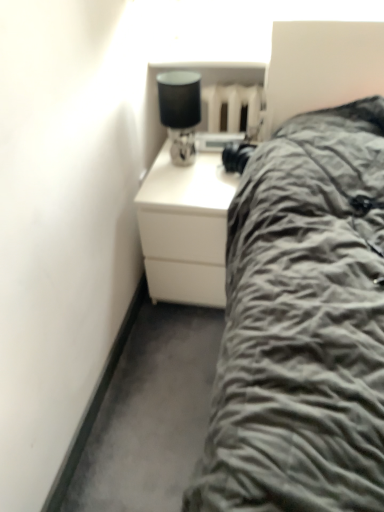
Where is `white matte chest of drawers at center`? Image resolution: width=384 pixels, height=512 pixels. white matte chest of drawers at center is located at coordinates tap(185, 228).

The image size is (384, 512). What do you see at coordinates (185, 228) in the screenshot? I see `white matte chest of drawers at center` at bounding box center [185, 228].

Measure the distance between point (203, 259) and camera.

They are 5.21 feet apart.

This screenshot has height=512, width=384. What are the coordinates of `matte black lampshade at upper right` in the screenshot? It's located at (180, 112).

Describe the element at coordinates (180, 112) in the screenshot. I see `matte black lampshade at upper right` at that location.

This screenshot has width=384, height=512. I want to click on white matte chest of drawers at center, so click(x=185, y=228).

Which object is positioned more to the right, matte black lampshade at upper right or white matte chest of drawers at center?

From the viewer's perspective, white matte chest of drawers at center appears more on the right side.

Considering their positions, is matte black lampshade at upper right located in front of or behind white matte chest of drawers at center?

In the image, matte black lampshade at upper right appears in front of white matte chest of drawers at center.

Which is in front, point (188, 75) or point (179, 192)?

The point (188, 75) is closer to the camera.

From the image's perspective, is matte black lampshade at upper right on white matte chest of drawers at center?

Yes, from the image's perspective, matte black lampshade at upper right is over white matte chest of drawers at center.

From the picture: From a real-world perspective, is matte black lampshade at upper right physically below white matte chest of drawers at center?

Actually, matte black lampshade at upper right is physically above white matte chest of drawers at center in the real world.

Between matte black lampshade at upper right and white matte chest of drawers at center, which one has larger width?

white matte chest of drawers at center.

Who is shorter, matte black lampshade at upper right or white matte chest of drawers at center?

With less height is matte black lampshade at upper right.

Who is bigger, matte black lampshade at upper right or white matte chest of drawers at center?

white matte chest of drawers at center is bigger.

Can we say matte black lampshade at upper right lies outside white matte chest of drawers at center?

Yes, matte black lampshade at upper right is not within white matte chest of drawers at center.

Is matte black lampshade at upper right not near white matte chest of drawers at center?

matte black lampshade at upper right is actually quite close to white matte chest of drawers at center.

Is matte black lampshade at upper right facing towards white matte chest of drawers at center?

No, matte black lampshade at upper right is not facing towards white matte chest of drawers at center.

What's the angular difference between matte black lampshade at upper right and white matte chest of drawers at center's facing directions?

0.843 degrees separate the facing orientations of matte black lampshade at upper right and white matte chest of drawers at center.

At what (x,y) coordinates should I click in order to perform the action: click on the chest of drawers located below the matte black lampshade at upper right (from the image's perspective). Please return your answer as a coordinate pair (x, y). The width and height of the screenshot is (384, 512). Looking at the image, I should click on (185, 228).

Can you confirm if white matte chest of drawers at center is positioned to the right of matte black lampshade at upper right?

Yes, white matte chest of drawers at center is to the right of matte black lampshade at upper right.

Does white matte chest of drawers at center come in front of matte black lampshade at upper right?

No, it is not.

Which is nearer, (212, 174) or (185, 93)?

The point (185, 93) is more forward.

From the image's perspective, is white matte chest of drawers at center on matte black lampshade at upper right?

No, from the image's perspective, white matte chest of drawers at center is not above matte black lampshade at upper right.

From a real-world perspective, relative to matte black lampshade at upper right, is white matte chest of drawers at center vertically above or below?

white matte chest of drawers at center is below matte black lampshade at upper right.

Consider the image. Does white matte chest of drawers at center have a lesser width compared to matte black lampshade at upper right?

No.

Which of these two, white matte chest of drawers at center or matte black lampshade at upper right, stands shorter?

matte black lampshade at upper right is shorter.

Can you confirm if white matte chest of drawers at center is smaller than matte black lampshade at upper right?

No, white matte chest of drawers at center is not smaller than matte black lampshade at upper right.

Is white matte chest of drawers at center inside the boundaries of matte black lampshade at upper right, or outside?

white matte chest of drawers at center is outside matte black lampshade at upper right.

Are white matte chest of drawers at center and matte black lampshade at upper right beside each other?

There is a gap between white matte chest of drawers at center and matte black lampshade at upper right.

Could you tell me if white matte chest of drawers at center is facing matte black lampshade at upper right?

No, white matte chest of drawers at center is not oriented towards matte black lampshade at upper right.

How different are the orientations of white matte chest of drawers at center and matte black lampshade at upper right in degrees?

The facing directions of white matte chest of drawers at center and matte black lampshade at upper right are 0.843 degrees apart.

How much distance is there between white matte chest of drawers at center and matte black lampshade at upper right?

The distance of white matte chest of drawers at center from matte black lampshade at upper right is 25.32 centimeters.

Image resolution: width=384 pixels, height=512 pixels. Identify the location of chest of drawers below the matte black lampshade at upper right (from the image's perspective). (185, 228).

Locate an element on the screen. bedside lamp on the left of white matte chest of drawers at center is located at coordinates (180, 112).

Locate an element on the screen. The height and width of the screenshot is (512, 384). bedside lamp above the white matte chest of drawers at center (from a real-world perspective) is located at coordinates (180, 112).